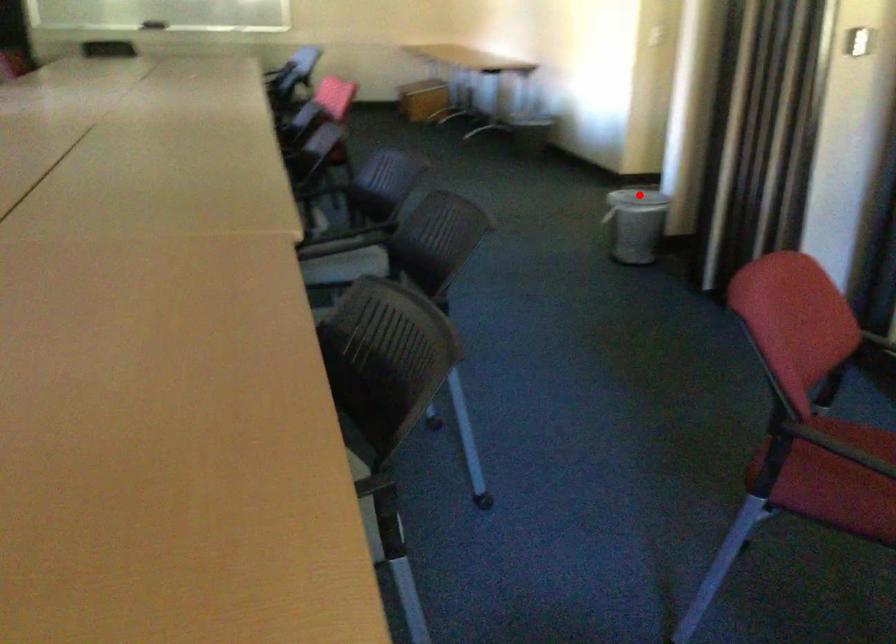
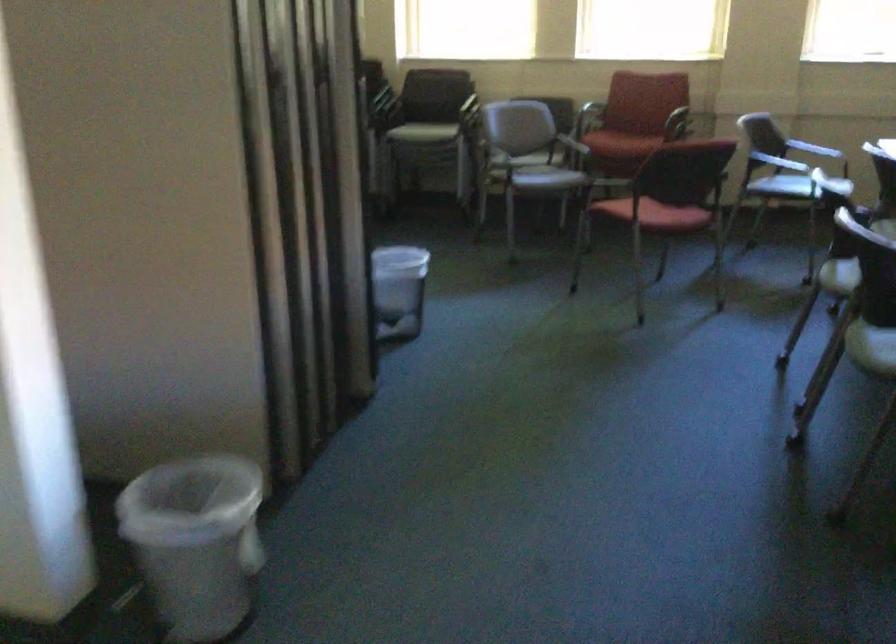
Question: I am providing you with two images of the same scene from different viewpoints. Given a red point in image1, look at the same physical point in image2. Is it:

Choices:
 (A) Closer to the viewpoint
 (B) Farther from the viewpoint

Answer: (A)